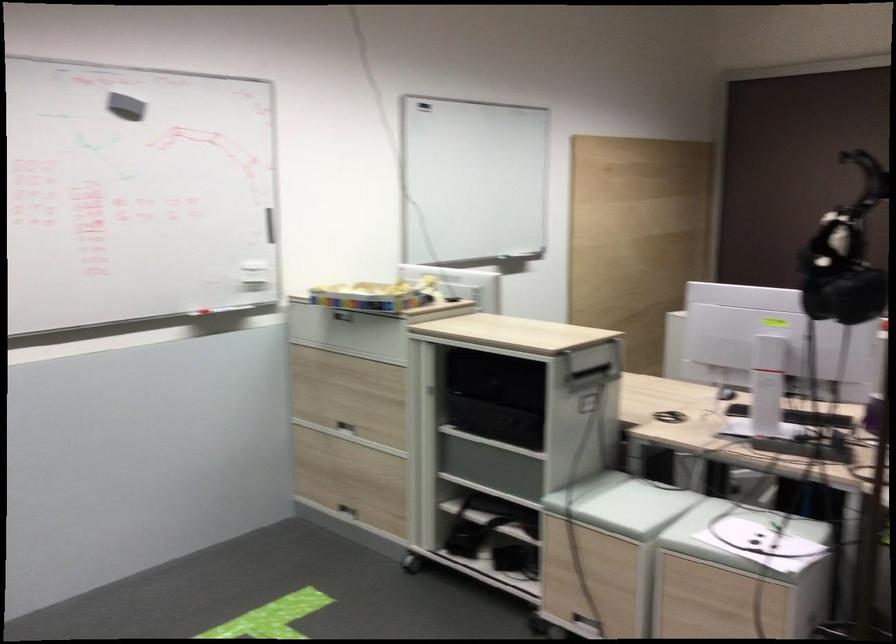
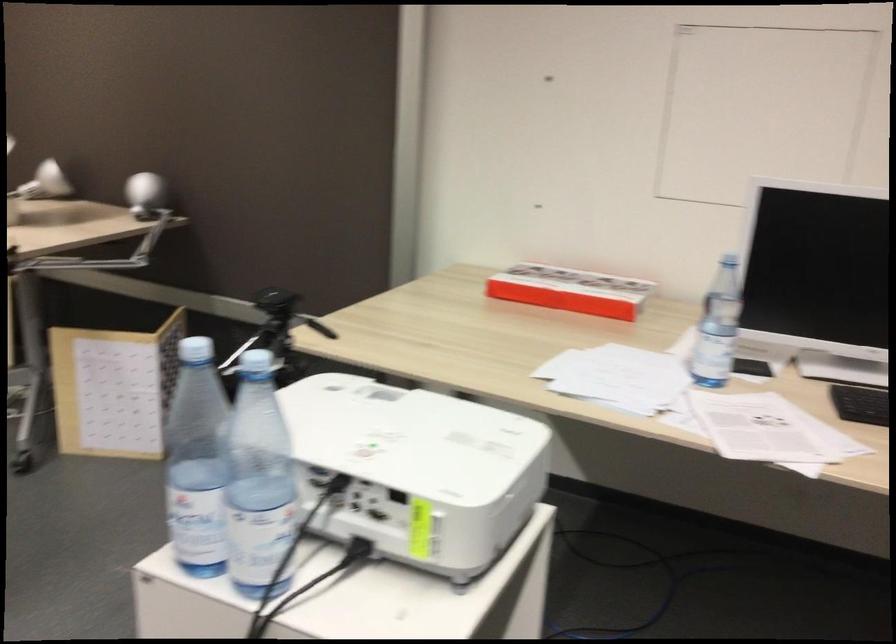
Which direction would the cameraman need to move to produce the second image?

The movement direction of the cameraman is right, forward.